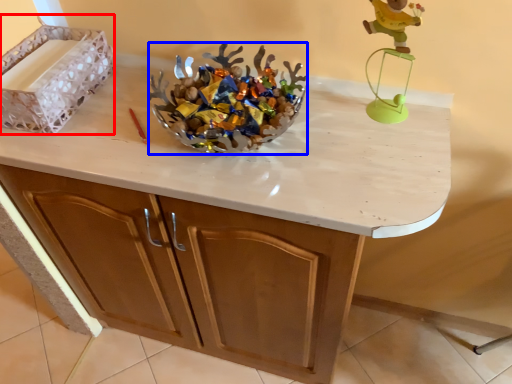
Question: Which object appears closest to the camera in this image, crate (highlighted by a red box) or stuff (highlighted by a blue box)?

Choices:
 (A) crate
 (B) stuff

Answer: (B)